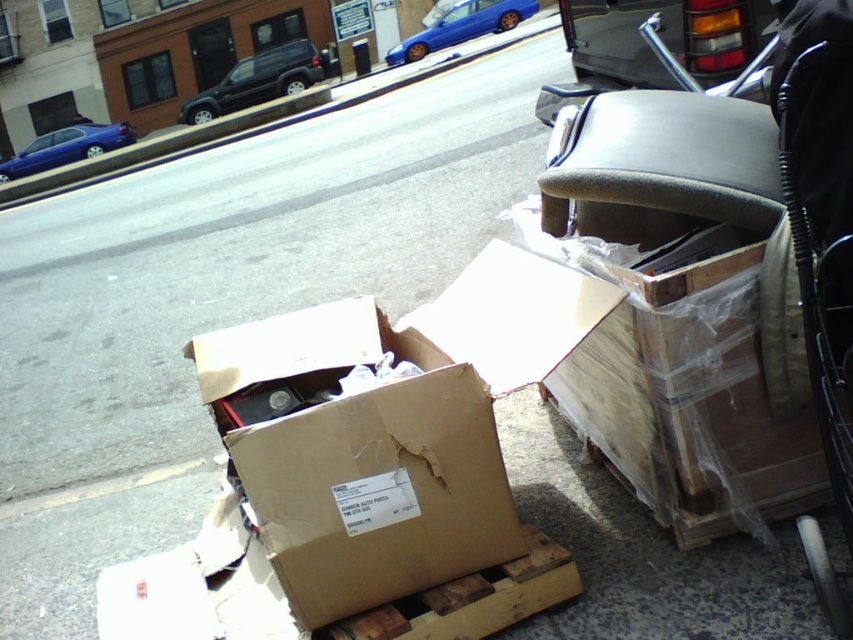
Which is more to the left, brown cardboard box at center or metallic gray tail light at upper right?

brown cardboard box at center

Between point (354, 563) and point (648, 54), which one is positioned behind?

The point (648, 54) is more distant.

Find the location of a particular element. The height and width of the screenshot is (640, 853). brown cardboard box at center is located at coordinates (357, 458).

This screenshot has height=640, width=853. I want to click on brown cardboard box at center, so click(357, 458).

Between metallic gray tail light at upper right and blue glossy sedan at upper center, which one has more height?

Standing taller between the two is blue glossy sedan at upper center.

Is point (643, 77) farther from viewer compared to point (409, 51)?

No, it is not.

This screenshot has height=640, width=853. I want to click on metallic gray tail light at upper right, so click(663, 38).

Which is below, metallic gray tail light at upper right or black matte suv at upper left?

Positioned lower is metallic gray tail light at upper right.

Which of these two, metallic gray tail light at upper right or black matte suv at upper left, stands taller?

Standing taller between the two is black matte suv at upper left.

I want to click on metallic gray tail light at upper right, so click(x=663, y=38).